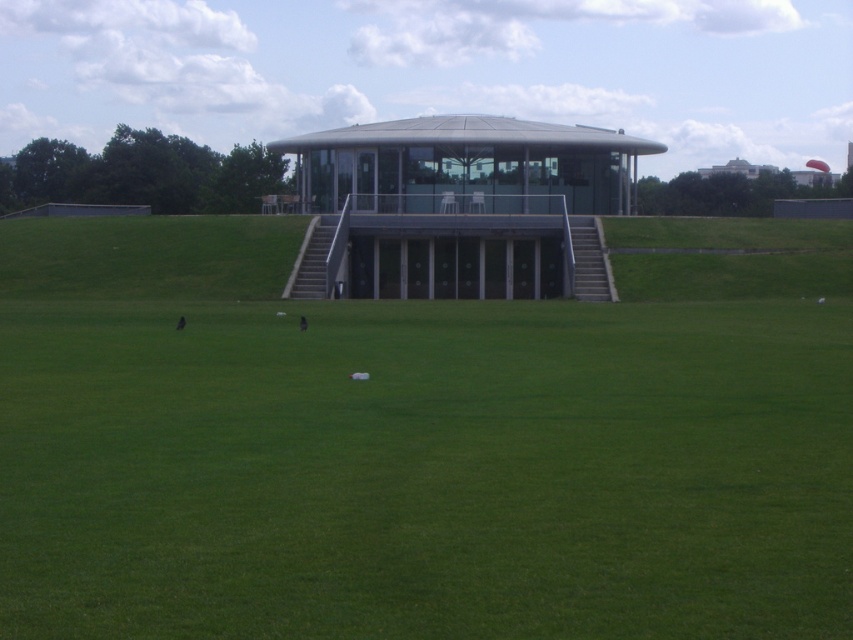
Please describe the location of the point marked at coordinates (407, 451) in the image of the modern building on the grassy hill.

The point marked at coordinates (407, 451) is located on the green grass at center.

You are a maintenance worker needing to mow the lawn between the green grass at center and the metallic glass gazebo at center. The lawnmower you have can cover a maximum distance of 15 meters in one go. Can you mow the entire area between them without stopping?

The distance between the green grass at center and the metallic glass gazebo at center is 16.07 meters, which exceeds the lawnmower maximum distance of 15 meters. Therefore, you cannot mow the entire area between them without stopping.